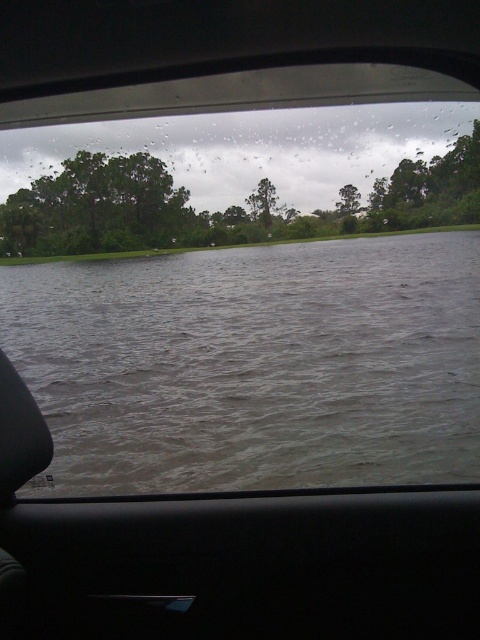
Question: Based on their relative distances, which object is farther from the green leafy tree at center?

Choices:
 (A) gray water at center
 (B) green leafy tree at upper center

Answer: (A)

Question: Can you confirm if gray water at center is smaller than green leafy tree at center?

Choices:
 (A) yes
 (B) no

Answer: (B)

Question: Is gray water at center closer to camera compared to green leafy tree at center?

Choices:
 (A) yes
 (B) no

Answer: (A)

Question: Among these objects, which one is nearest to the camera?

Choices:
 (A) green leafy tree at upper center
 (B) gray water at center

Answer: (B)

Question: Which point is closer to the camera?

Choices:
 (A) (356, 204)
 (B) (197, 419)

Answer: (B)

Question: Is green leafy tree at upper center to the right of green leafy tree at center from the viewer's perspective?

Choices:
 (A) yes
 (B) no

Answer: (B)